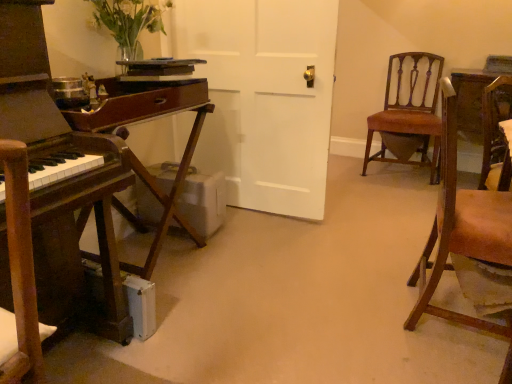
Question: Considering the relative sizes of brown leather chair at right, arranged as the second chair when viewed from the back, and brown wood table at left in the image provided, is brown leather chair at right, arranged as the second chair when viewed from the back, taller than brown wood table at left?

Choices:
 (A) no
 (B) yes

Answer: (B)

Question: Would you say brown wood table at left is part of brown leather chair at right, positioned as the 1th chair in front-to-back order,'s contents?

Choices:
 (A) no
 (B) yes

Answer: (A)

Question: From the image's perspective, is brown leather chair at right, arranged as the second chair when viewed from the back, located beneath brown wood table at left?

Choices:
 (A) yes
 (B) no

Answer: (A)

Question: Is brown leather chair at right, positioned as the 1th chair in front-to-back order, shorter than brown wood table at left?

Choices:
 (A) no
 (B) yes

Answer: (A)

Question: Does brown leather chair at right, positioned as the 1th chair in front-to-back order, have a lesser width compared to brown wood table at left?

Choices:
 (A) yes
 (B) no

Answer: (A)

Question: From the image's perspective, is brown leather chair at right, positioned as the 1th chair in front-to-back order, located above brown wood table at left?

Choices:
 (A) no
 (B) yes

Answer: (A)

Question: Is brown wood table at left bigger than translucent glass vase at upper left?

Choices:
 (A) yes
 (B) no

Answer: (A)

Question: Does brown wood table at left have a lesser height compared to translucent glass vase at upper left?

Choices:
 (A) no
 (B) yes

Answer: (A)

Question: Is brown wood table at left closer to the viewer compared to translucent glass vase at upper left?

Choices:
 (A) yes
 (B) no

Answer: (A)

Question: Can you confirm if brown wood table at left is positioned to the left of translucent glass vase at upper left?

Choices:
 (A) yes
 (B) no

Answer: (A)

Question: Does brown wood table at left have a greater width compared to translucent glass vase at upper left?

Choices:
 (A) yes
 (B) no

Answer: (A)

Question: Does brown wood table at left have a lesser width compared to translucent glass vase at upper left?

Choices:
 (A) no
 (B) yes

Answer: (A)

Question: Does brown leather chair at right, arranged as the second chair when viewed from the back, lie behind brown leather chair at right, the second chair from the front?

Choices:
 (A) yes
 (B) no

Answer: (B)